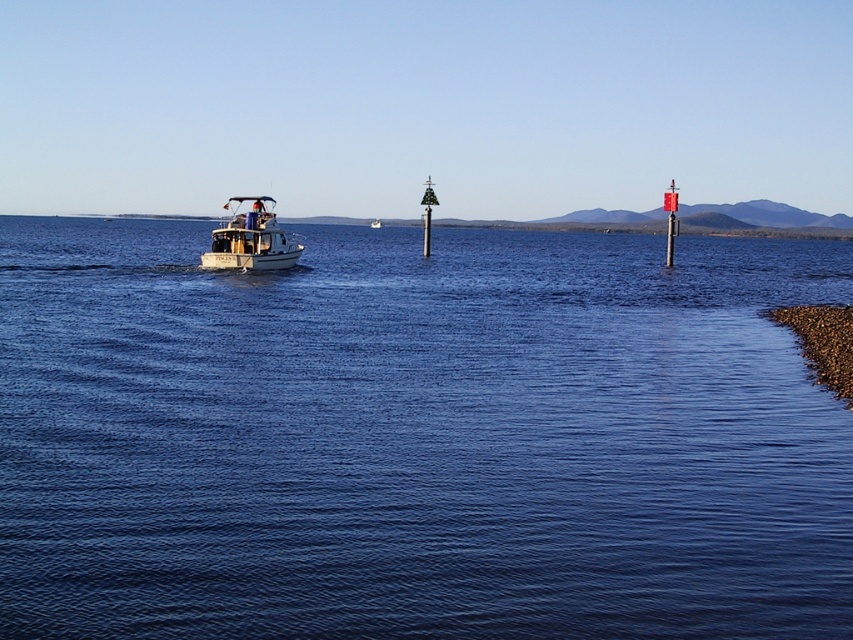
Question: Observing the image, what is the correct spatial positioning of blue water at center in reference to white glossy boat at center-left?

Choices:
 (A) below
 (B) above

Answer: (B)

Question: Which point is closer to the camera?

Choices:
 (A) (212, 252)
 (B) (341, 276)

Answer: (A)

Question: Is blue water at center above white glossy boat at center-left?

Choices:
 (A) no
 (B) yes

Answer: (B)

Question: Does blue water at center have a greater width compared to white glossy boat at center-left?

Choices:
 (A) no
 (B) yes

Answer: (B)